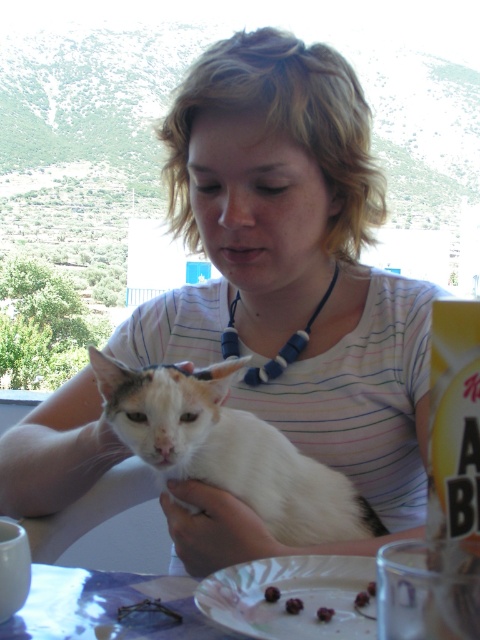
You are a guest at this table and want to grab both the shiny dark chocolate cherry at plate center and the smooth brown cookie at lower center. Which one should you reach for first if you want to pick up the item that is closer to your right hand?

The smooth brown cookie at lower center is to the right of the shiny dark chocolate cherry at plate center, so you should reach for the smooth brown cookie at lower center first if you want the item closer to your right hand.

You are a photographer trying to capture a closeup of the white paper plate at lower center without the white fur cat at center blocking the view. Can you fit the plate entirely within your camera frame if the cat is currently occupying more space in the frame?

The white fur cat at center is wider than the white paper plate at lower center, so the cat occupies more space in the frame. To capture the plate without obstruction, you need to adjust your angle or move the cat aside.

You are a small robot with a 8 inch wide arm. You need to pick up the smooth brown cookie at lower center while holding the white fur cat at center. Is your arm long enough to reach the cookie without dropping the cat?

The distance between the white fur cat at center and the smooth brown cookie at lower center is 10.07 inches. Since your arm is only 8 inches wide, it is not long enough to reach the cookie while holding the cat without dropping it.